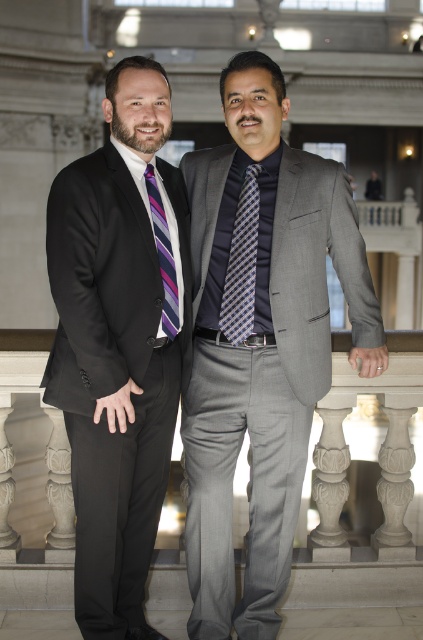
What is the color of the plaid silk tie at center represented by point (241, 262)?

The plaid silk tie at center represented by point (241, 262) is blue and white.

You are an event organizer planning to seat these two gentlemen. Given that the seating arrangement requires knowing the width of their attire, can you determine which of the two items, the matte black suit at left or the purple striped tie at left, is wider?

The matte black suit at left is wider than the purple striped tie at left according to the description.

You are a photographer trying to capture a closeup of the matte black suit at left. Given that the camera is focused on the point at coordinates point (120, 342), will the matte black suit at left be in focus?

The matte black suit at left is represented by point (120, 342). Since the camera is focused on that point, the matte black suit at left will be in focus.